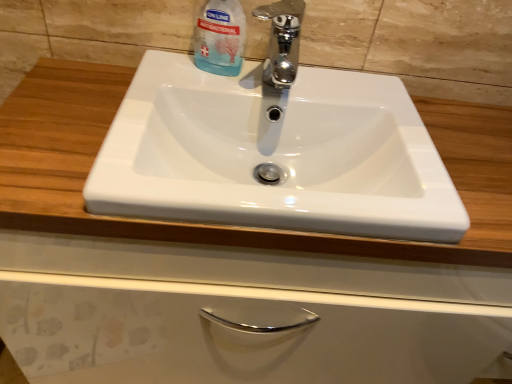
Find the location of a particular element. This screenshot has width=512, height=384. vacant space to the left of transparent plastic bottle at upper center is located at coordinates (168, 67).